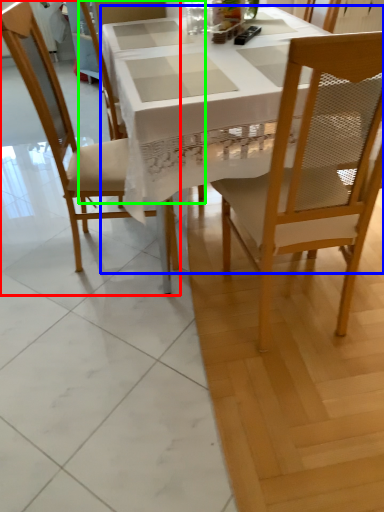
Question: Based on their relative distances, which object is nearer to chair (highlighted by a red box)? Choose from desk (highlighted by a blue box) and chair (highlighted by a green box).

Choices:
 (A) desk
 (B) chair

Answer: (A)